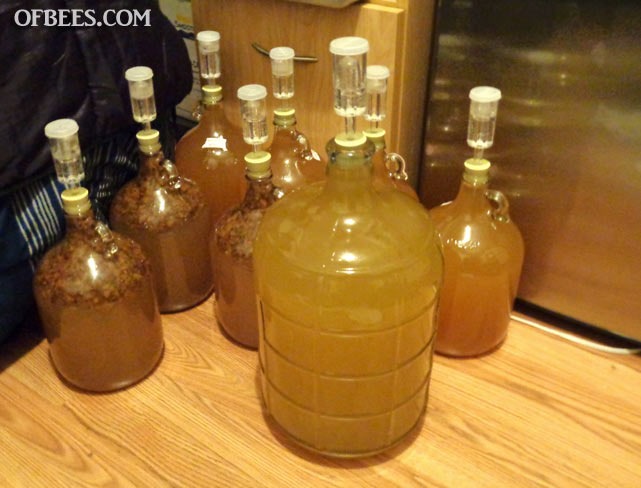
Locate an element on the screen. bottle is located at coordinates (283, 171).